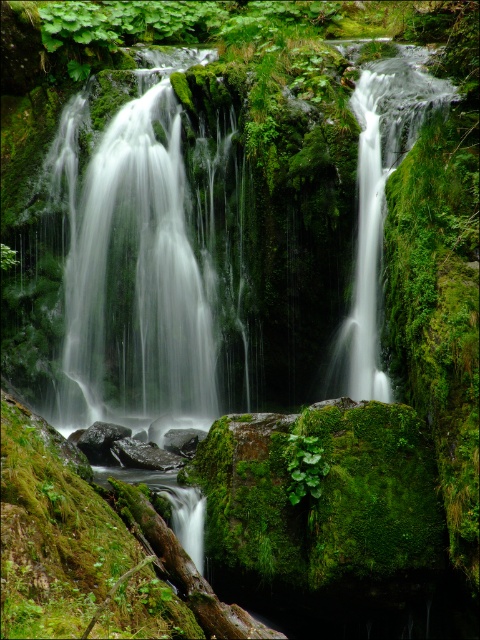
Does green mossy waterfall at center lie in front of white smooth waterfall at center?

No, it is behind white smooth waterfall at center.

Does green mossy waterfall at center have a smaller size compared to white smooth waterfall at center?

Incorrect, green mossy waterfall at center is not smaller in size than white smooth waterfall at center.

Image resolution: width=480 pixels, height=640 pixels. In order to click on green mossy waterfall at center in this screenshot , I will do `click(134, 266)`.

Is point (177, 260) positioned behind point (108, 428)?

Yes, it is.

Which is more to the left, green mossy waterfall at center or green mossy rock at lower center?

Positioned to the left is green mossy waterfall at center.

The image size is (480, 640). In order to click on green mossy waterfall at center in this screenshot , I will do `click(134, 266)`.

Where is `green mossy waterfall at center`? This screenshot has height=640, width=480. green mossy waterfall at center is located at coordinates click(134, 266).

Is white smooth waterfall at center to the left of green mossy rock at lower center from the viewer's perspective?

No, white smooth waterfall at center is not to the left of green mossy rock at lower center.

Locate an element on the screen. The height and width of the screenshot is (640, 480). white smooth waterfall at center is located at coordinates (364, 257).

Is point (365, 93) behind point (81, 442)?

Yes, point (365, 93) is behind point (81, 442).

I want to click on white smooth waterfall at center, so click(x=364, y=257).